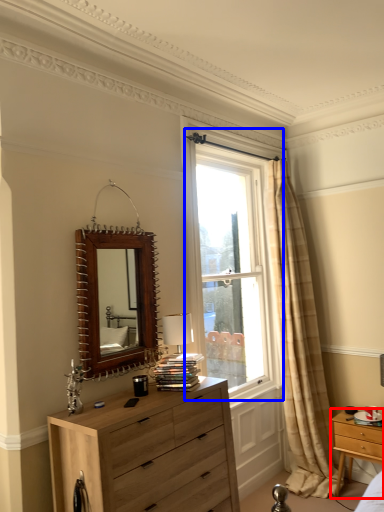
Question: Which object is closer to the camera taking this photo, nightstand (highlighted by a red box) or window (highlighted by a blue box)?

Choices:
 (A) nightstand
 (B) window

Answer: (A)